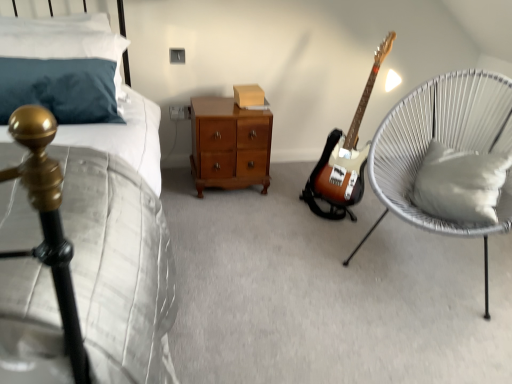
Question: Can you confirm if sunburst wood electric guitar at center is positioned to the right of teal fabric pillow at upper left, which appears as the second pillow when ordered from the bottom?

Choices:
 (A) no
 (B) yes

Answer: (B)

Question: Would you consider sunburst wood electric guitar at center to be distant from teal fabric pillow at upper left, which appears as the second pillow when ordered from the bottom?

Choices:
 (A) yes
 (B) no

Answer: (A)

Question: Is sunburst wood electric guitar at center looking in the opposite direction of teal fabric pillow at upper left, placed as the first pillow when sorted from left to right?

Choices:
 (A) no
 (B) yes

Answer: (A)

Question: From the image's perspective, does sunburst wood electric guitar at center appear lower than teal fabric pillow at upper left, the 2th pillow from the right?

Choices:
 (A) no
 (B) yes

Answer: (B)

Question: Are sunburst wood electric guitar at center and teal fabric pillow at upper left, which is the 1th pillow in top-to-bottom order, beside each other?

Choices:
 (A) yes
 (B) no

Answer: (B)

Question: Is sunburst wood electric guitar at center bigger or smaller than white soft cushion at right, which is the 1th pillow from bottom to top?

Choices:
 (A) small
 (B) big

Answer: (B)

Question: Considering the positions of sunburst wood electric guitar at center and white soft cushion at right, placed as the 2th pillow when sorted from top to bottom, in the image, is sunburst wood electric guitar at center wider or thinner than white soft cushion at right, placed as the 2th pillow when sorted from top to bottom,?

Choices:
 (A) thin
 (B) wide

Answer: (B)

Question: From the image's perspective, is sunburst wood electric guitar at center located above or below white soft cushion at right, the first pillow viewed from the right?

Choices:
 (A) above
 (B) below

Answer: (A)

Question: Is sunburst wood electric guitar at center taller or shorter than white soft cushion at right, which is the 1th pillow from bottom to top?

Choices:
 (A) short
 (B) tall

Answer: (B)

Question: Does point (48, 132) appear closer or farther from the camera than point (401, 122)?

Choices:
 (A) farther
 (B) closer

Answer: (B)

Question: In terms of size, does matte gold headboard at left appear bigger or smaller than white woven chair at right?

Choices:
 (A) small
 (B) big

Answer: (B)

Question: From a real-world perspective, is matte gold headboard at left positioned above or below white woven chair at right?

Choices:
 (A) above
 (B) below

Answer: (B)

Question: Considering the positions of matte gold headboard at left and white woven chair at right in the image, is matte gold headboard at left taller or shorter than white woven chair at right?

Choices:
 (A) short
 (B) tall

Answer: (A)

Question: From the image's perspective, is white soft cushion at right, the first pillow viewed from the right, located above or below matte cardboard box at center?

Choices:
 (A) above
 (B) below

Answer: (B)

Question: Looking at their shapes, would you say white soft cushion at right, which is the 1th pillow from bottom to top, is wider or thinner than matte cardboard box at center?

Choices:
 (A) wide
 (B) thin

Answer: (A)